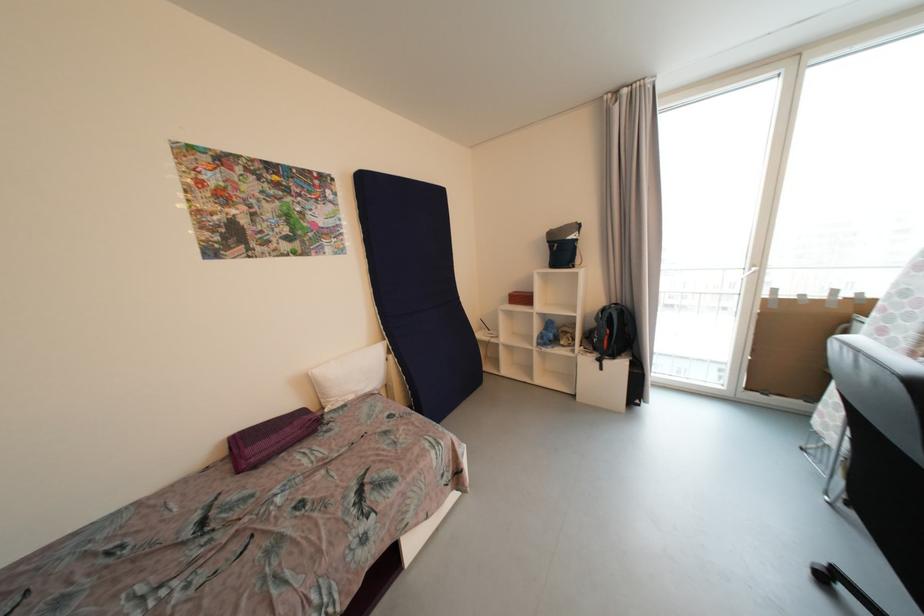
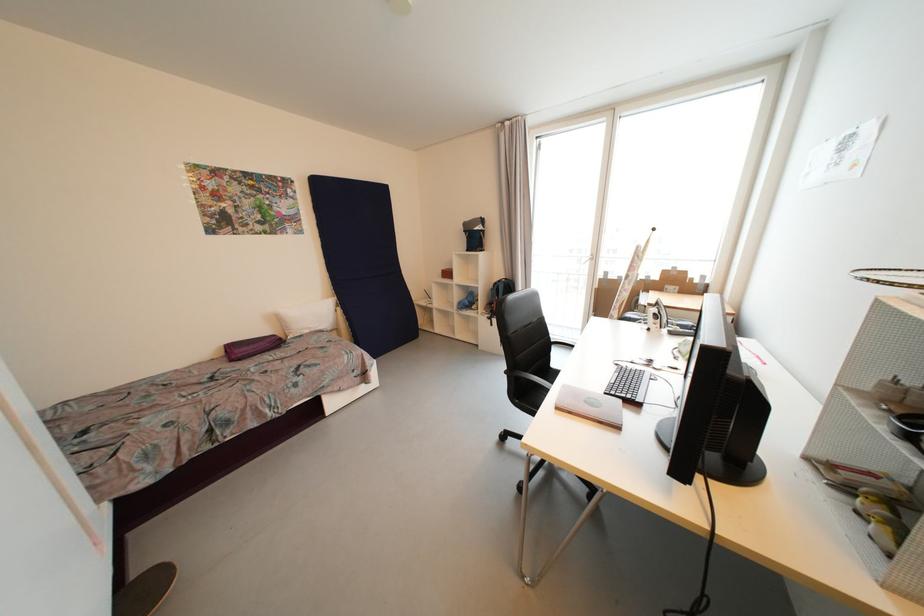
Question: I am providing you with two images of the same scene from different viewpoints. Which of the following objects are not visible in image2?

Choices:
 (A) cardboard box
 (B) grey backpack
 (C) white pillow
 (D) black toilet brush

Answer: (A)